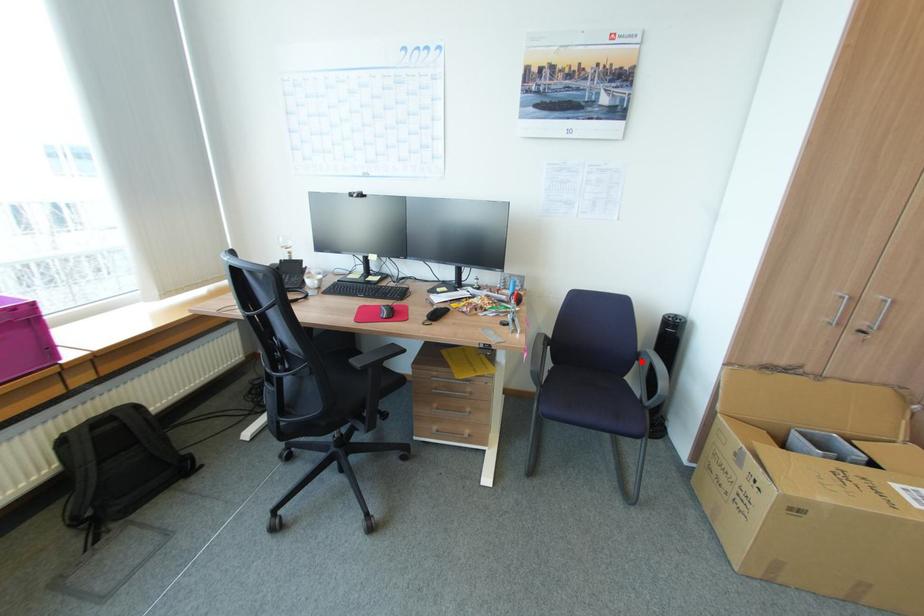
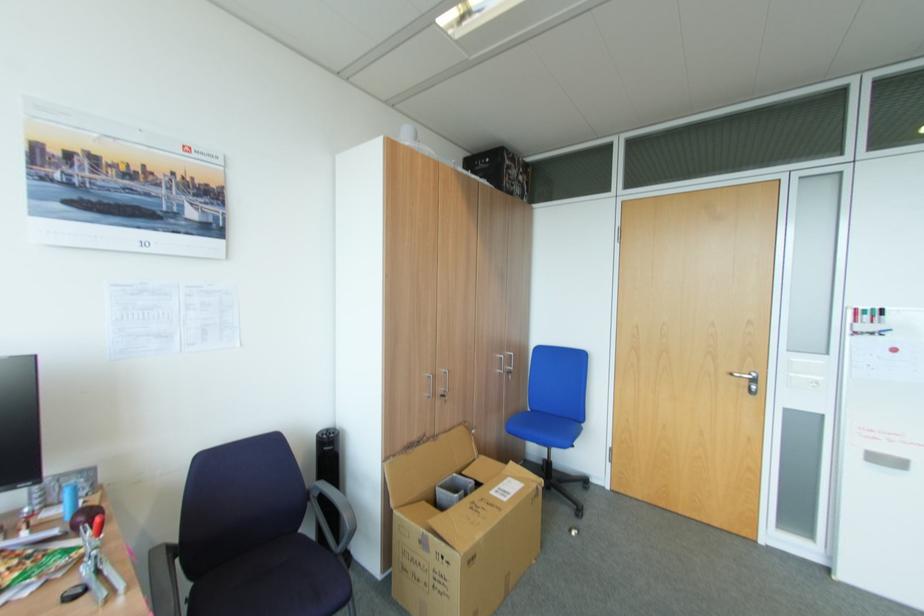
Question: I am providing you with two images of the same scene from different viewpoints. A red point is shown in image1. For the corresponding object point in image2, is it positioned nearer or farther from the camera?

Choices:
 (A) Nearer
 (B) Farther

Answer: (B)